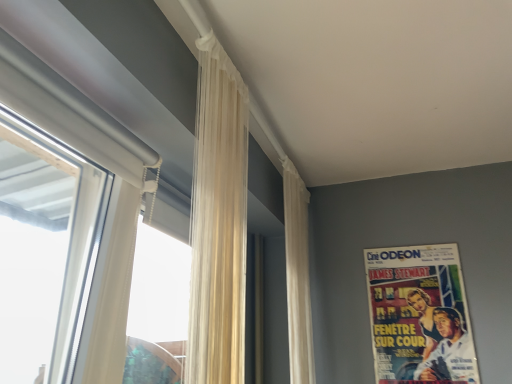
Question: Is white matte window at left bigger than translucent cream curtain at center, the second curtain viewed from the back?

Choices:
 (A) yes
 (B) no

Answer: (A)

Question: Can you confirm if white matte window at left is positioned to the right of translucent cream curtain at center, the 2th curtain positioned from the right?

Choices:
 (A) yes
 (B) no

Answer: (B)

Question: From a real-world perspective, is white matte window at left physically above translucent cream curtain at center, placed as the 1th curtain when sorted from front to back?

Choices:
 (A) no
 (B) yes

Answer: (A)

Question: Can you confirm if white matte window at left is wider than translucent cream curtain at center, the first curtain positioned from the left?

Choices:
 (A) no
 (B) yes

Answer: (B)

Question: From a real-world perspective, is white matte window at left positioned under translucent cream curtain at center, the first curtain positioned from the left, based on gravity?

Choices:
 (A) yes
 (B) no

Answer: (A)

Question: Does white matte window at left turn towards translucent cream curtain at center, placed as the 1th curtain when sorted from front to back?

Choices:
 (A) no
 (B) yes

Answer: (B)

Question: Are white sheer curtain at upper center, which ranks as the second curtain in front-to-back order, and translucent cream curtain at center, placed as the 1th curtain when sorted from front to back, far apart?

Choices:
 (A) no
 (B) yes

Answer: (A)

Question: Could you tell me if white sheer curtain at upper center, which is counted as the second curtain, starting from the left, is turned towards translucent cream curtain at center, the 2th curtain positioned from the right?

Choices:
 (A) yes
 (B) no

Answer: (B)

Question: Is white sheer curtain at upper center, which is counted as the second curtain, starting from the left, further to the viewer compared to translucent cream curtain at center, the first curtain positioned from the left?

Choices:
 (A) yes
 (B) no

Answer: (A)

Question: Does white sheer curtain at upper center, which is counted as the second curtain, starting from the left, have a smaller size compared to translucent cream curtain at center, the 2th curtain positioned from the right?

Choices:
 (A) no
 (B) yes

Answer: (A)

Question: From a real-world perspective, is white sheer curtain at upper center, which is the first curtain in right-to-left order, located higher than translucent cream curtain at center, the first curtain positioned from the left?

Choices:
 (A) yes
 (B) no

Answer: (B)

Question: Can you confirm if white sheer curtain at upper center, which ranks as the second curtain in front-to-back order, is shorter than translucent cream curtain at center, the second curtain viewed from the back?

Choices:
 (A) yes
 (B) no

Answer: (B)

Question: Does vintage paper poster at upper right have a smaller size compared to white matte window at left?

Choices:
 (A) yes
 (B) no

Answer: (A)